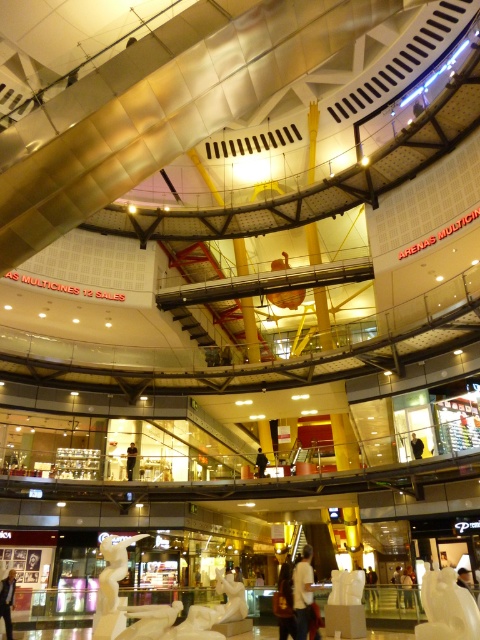
You are a customer in the mall and want to know which object is taller between the white matte statue at center and the dark blue jeans at center. Can you help me figure that out?

The white matte statue at center is taller than the dark blue jeans at center.

You are a customer in the mall looking for a gift. You see a white fabric shirt at lower center and a white matte statue at center. Which item is closer to the right side of the store?

The white fabric shirt at lower center is closer to the right side of the store because it is positioned to the right of the white matte statue at center.